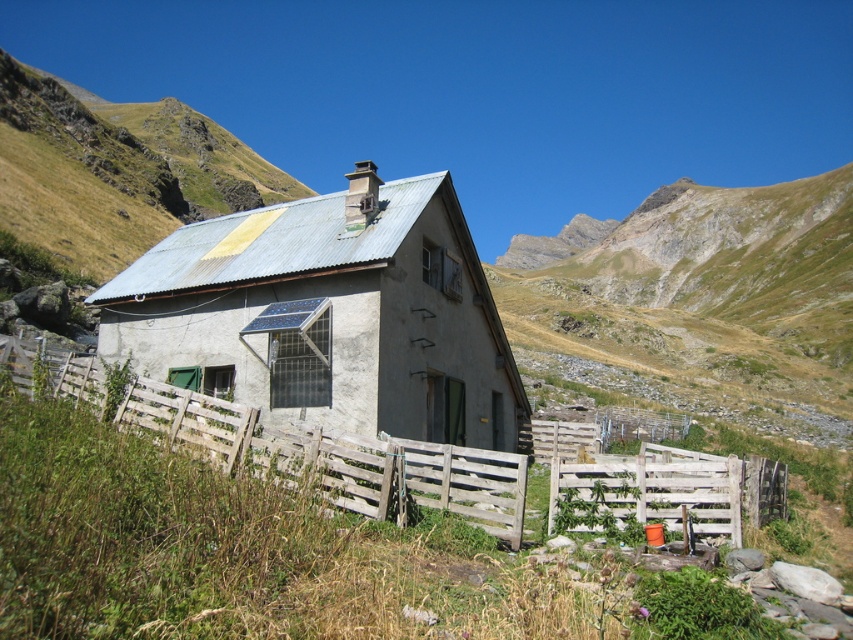
You are a delivery person trying to determine the best way to approach the rusty metal cottage at center and the wooden at center. Based on their heights, which structure should you approach first to avoid obstacles?

The rusty metal cottage at center is taller than the wooden at center, so you should approach the wooden at center first to avoid obstacles.